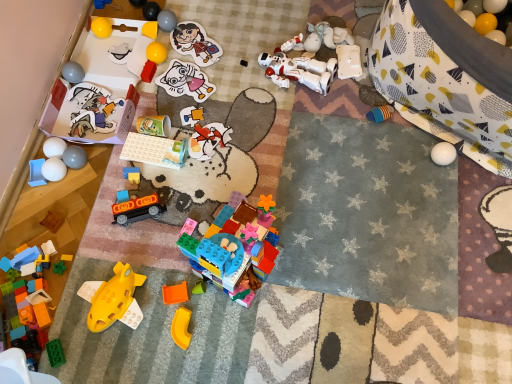
You are a GUI agent. You are given a task and a screenshot of the screen. Output one action in this format:
    pyautogui.click(x=<x>, y=<y>)
    Task: Click on the unoccupied region to the right of white matte balls at left, placed as the 22th toy when sorted from right to left
    The width and height of the screenshot is (512, 384).
    Given the screenshot: What is the action you would take?
    pyautogui.click(x=108, y=175)